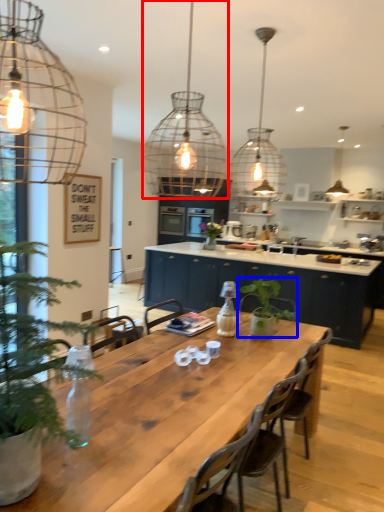
Question: Which object appears farthest to the camera in this image, light fixture (highlighted by a red box) or houseplant (highlighted by a blue box)?

Choices:
 (A) light fixture
 (B) houseplant

Answer: (B)